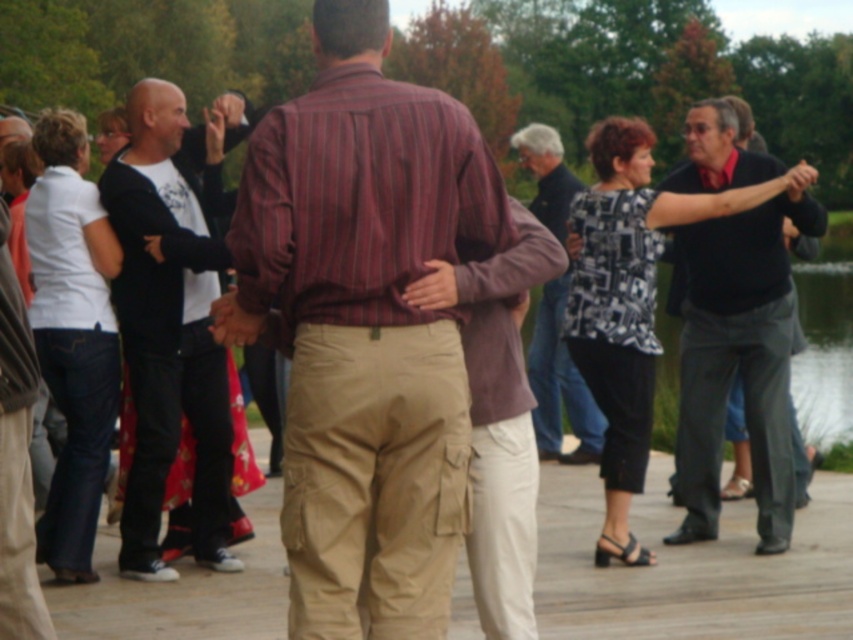
Looking at this image, you are a photographer trying to capture a group photo of the striped cotton shirt at center and the dark gray pants at right. Since you want to include both subjects in the frame, which direction should you position the camera relative to their current positions?

The striped cotton shirt at center is positioned on the left side of dark gray pants at right, so to include both subjects in the frame, the camera should be positioned to the left of the striped cotton shirt at center and to the right of the dark gray pants at right.